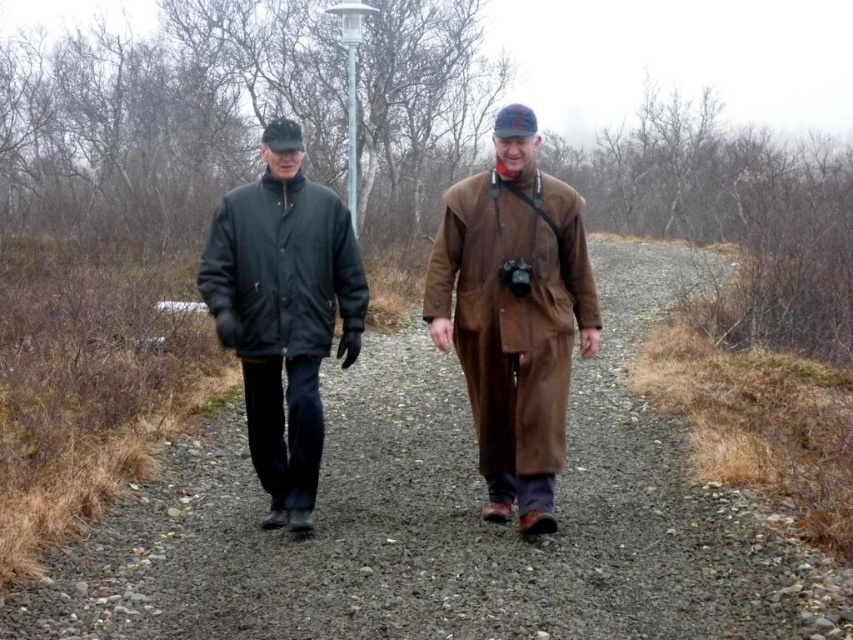
You are a photographer trying to capture both the matte black jacket at center and the matte black jacket at left in a single frame. Based on their positions, which jacket should you adjust your camera angle to focus on first to ensure both are in the shot?

Since the matte black jacket at center is to the right of the matte black jacket at left, you should first focus on the matte black jacket at left to ensure both are captured in the frame.

You are a photographer trying to capture a landscape shot of the gravel path between the two people. You need to place your tripod at point (514, 314). What object will be directly under the tripod?

The brown leather coat at center is located at point (514, 314), so placing the tripod there would position it directly over the brown leather coat at center.